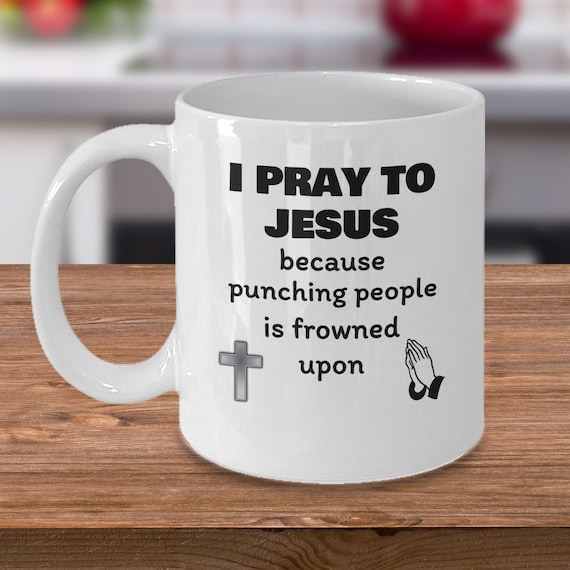
What are the coordinates of `blurry white countertop, top of image` in the screenshot? It's located at (71, 63), (549, 76).